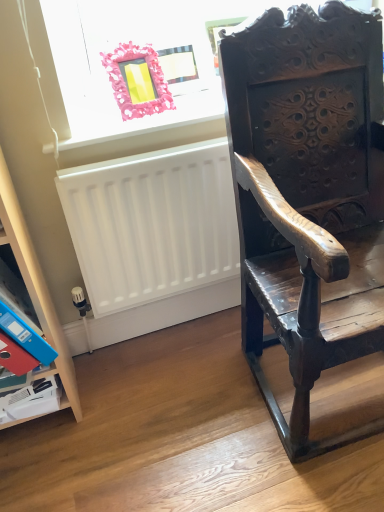
Question: Can you confirm if white matte radiator at lower left is thinner than wooden shelf at lower left?

Choices:
 (A) no
 (B) yes

Answer: (B)

Question: Is white matte radiator at lower left next to wooden shelf at lower left?

Choices:
 (A) no
 (B) yes

Answer: (A)

Question: Is white matte radiator at lower left shorter than wooden shelf at lower left?

Choices:
 (A) no
 (B) yes

Answer: (B)

Question: Considering the relative sizes of white matte radiator at lower left and wooden shelf at lower left in the image provided, is white matte radiator at lower left bigger than wooden shelf at lower left?

Choices:
 (A) yes
 (B) no

Answer: (B)

Question: From the image's perspective, is white matte radiator at lower left under wooden shelf at lower left?

Choices:
 (A) no
 (B) yes

Answer: (A)

Question: Is white matte radiator at lower left not near wooden shelf at lower left?

Choices:
 (A) no
 (B) yes

Answer: (A)

Question: Is wooden shelf at lower left oriented away from red paper at lower left?

Choices:
 (A) yes
 (B) no

Answer: (A)

Question: Could you tell me if wooden shelf at lower left is facing red paper at lower left?

Choices:
 (A) no
 (B) yes

Answer: (B)

Question: Would you say wooden shelf at lower left is a long distance from red paper at lower left?

Choices:
 (A) no
 (B) yes

Answer: (A)

Question: Considering the relative sizes of wooden shelf at lower left and red paper at lower left in the image provided, is wooden shelf at lower left wider than red paper at lower left?

Choices:
 (A) yes
 (B) no

Answer: (A)

Question: Is wooden shelf at lower left smaller than red paper at lower left?

Choices:
 (A) no
 (B) yes

Answer: (A)

Question: Is wooden shelf at lower left thinner than red paper at lower left?

Choices:
 (A) no
 (B) yes

Answer: (A)

Question: Is pink plastic frame at upper left far away from dark wood carved chair at right?

Choices:
 (A) no
 (B) yes

Answer: (A)